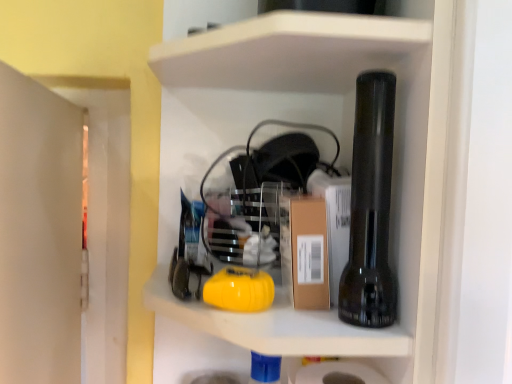
Question: From the image's perspective, is brown cardboard box at center located above or below black matte beer bottle at right?

Choices:
 (A) below
 (B) above

Answer: (A)

Question: From a real-world perspective, relative to black matte beer bottle at right, is brown cardboard box at center vertically above or below?

Choices:
 (A) below
 (B) above

Answer: (A)

Question: From their relative heights in the image, would you say brown cardboard box at center is taller or shorter than black matte beer bottle at right?

Choices:
 (A) tall
 (B) short

Answer: (B)

Question: In the image, is black matte beer bottle at right positioned in front of or behind brown cardboard box at center?

Choices:
 (A) behind
 (B) front

Answer: (B)

Question: Choose the correct answer: Is black matte beer bottle at right inside brown cardboard box at center or outside it?

Choices:
 (A) inside
 (B) outside

Answer: (B)

Question: From the image's perspective, relative to brown cardboard box at center, is black matte beer bottle at right above or below?

Choices:
 (A) below
 (B) above

Answer: (B)

Question: From a real-world perspective, is black matte beer bottle at right above or below brown cardboard box at center?

Choices:
 (A) above
 (B) below

Answer: (A)